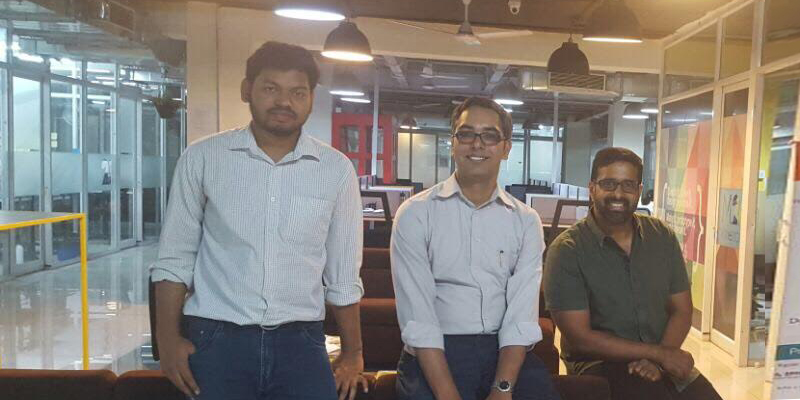
At what (x,y) coordinates should I click in order to perform the action: click on table. Please return your answer as a coordinate pair (x, y). The image size is (800, 400). Looking at the image, I should click on (37, 225).